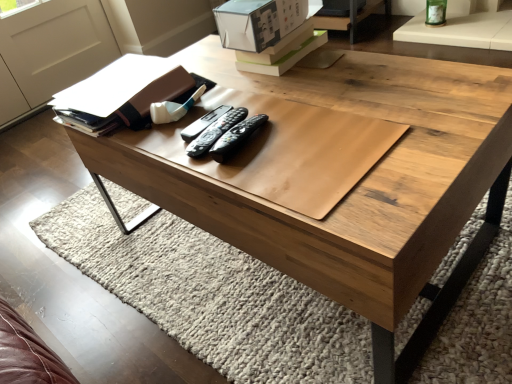
Question: Would you say black plastic remote at center, marked as the 2th remote in a right-to-left arrangement, is inside or outside black plastic remote at center, marked as the 1th remote in a left-to-right arrangement?

Choices:
 (A) inside
 (B) outside

Answer: (B)

Question: Based on their sizes in the image, would you say black plastic remote at center, marked as the 2th remote in a right-to-left arrangement, is bigger or smaller than black plastic remote at center, marked as the 1th remote in a left-to-right arrangement?

Choices:
 (A) small
 (B) big

Answer: (A)

Question: Based on their relative distances, which object is farther from the white cardboard box at upper center?

Choices:
 (A) black plastic remote at center, marked as the 1th remote in a left-to-right arrangement
 (B) black plastic remote at center, which ranks as the 2th remote in left-to-right order
 (C) matte brown book at upper left
 (D) black plastic remote at center, the 3th remote when ordered from left to right

Answer: (D)

Question: Which of these objects is positioned closest to the black plastic remote at center, which ranks as the 2th remote in left-to-right order?

Choices:
 (A) black plastic remote at center, which ranks as the third remote in right-to-left order
 (B) black plastic remote at center, acting as the 1th remote starting from the right
 (C) matte brown book at upper left
 (D) white cardboard box at upper center

Answer: (A)